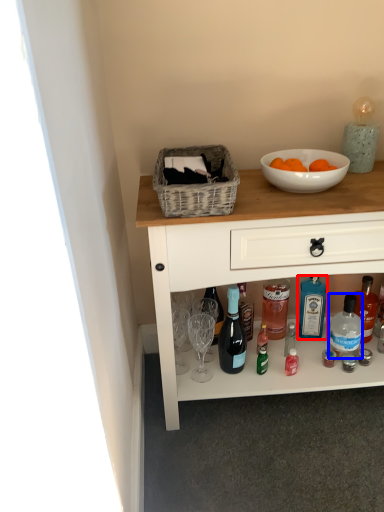
Question: Among these objects, which one is nearest to the camera, bottle (highlighted by a red box) or bottle (highlighted by a blue box)?

Choices:
 (A) bottle
 (B) bottle

Answer: (B)